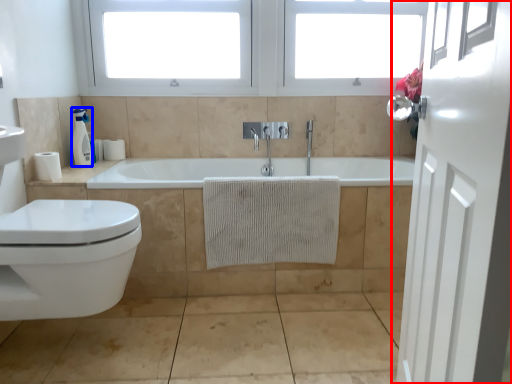
Question: Which object appears closest to the camera in this image, door (highlighted by a red box) or soap dispenser (highlighted by a blue box)?

Choices:
 (A) door
 (B) soap dispenser

Answer: (A)